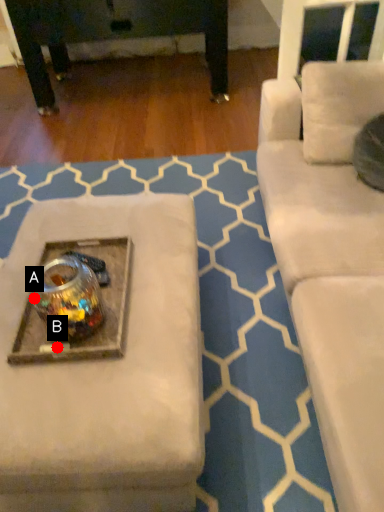
Question: Two points are circled on the image, labeled by A and B beside each circle. Which point appears closest to the camera in this image?

Choices:
 (A) A is closer
 (B) B is closer

Answer: (B)